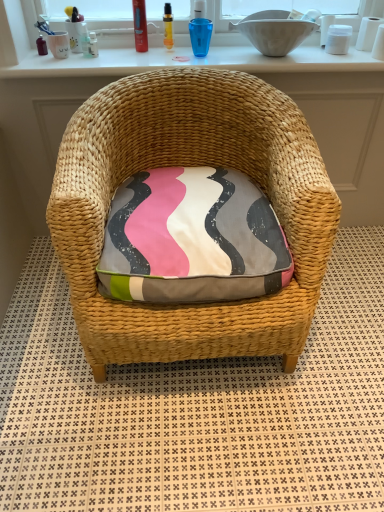
This screenshot has height=512, width=384. I want to click on vacant point above textured cotton cushion at center (from a real-world perspective), so click(x=189, y=189).